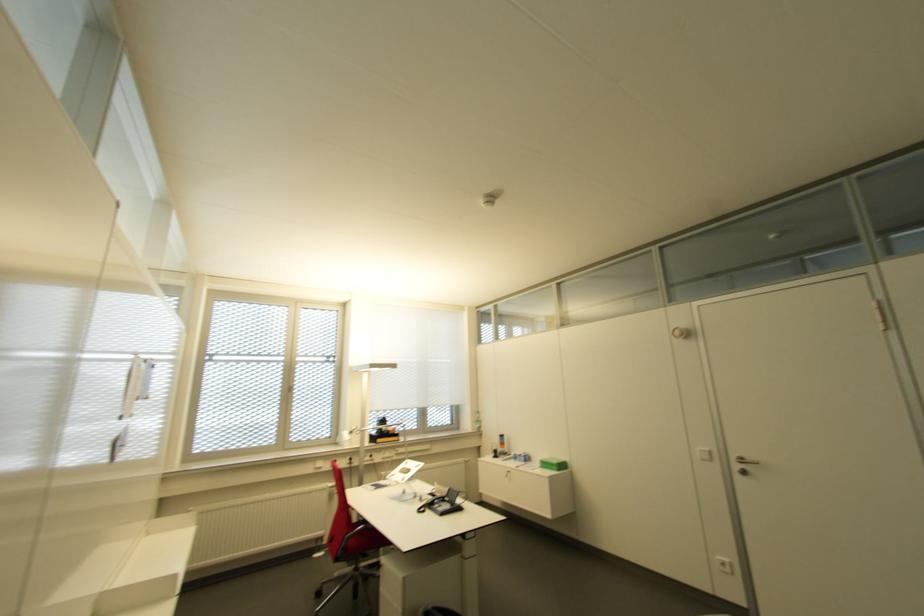
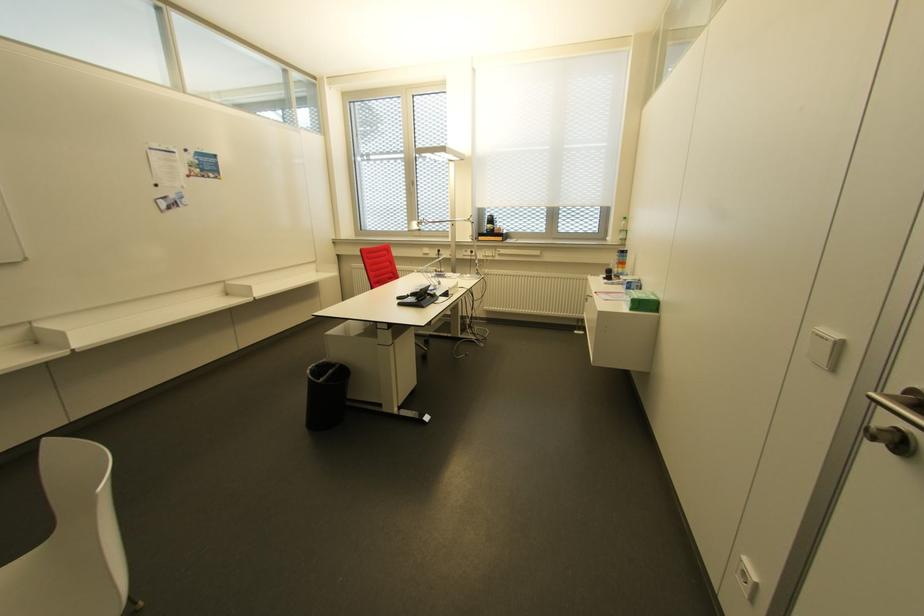
The point at (478,428) is marked in the first image. Where is the corresponding point in the second image?

(623, 240)